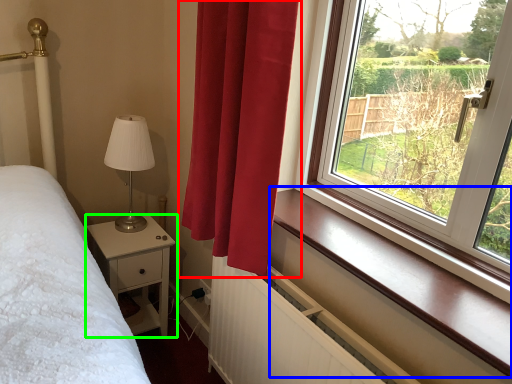
Question: Which is farther away from curtain (highlighted by a red box)? window sill (highlighted by a blue box) or nightstand (highlighted by a green box)?

Choices:
 (A) window sill
 (B) nightstand

Answer: (B)